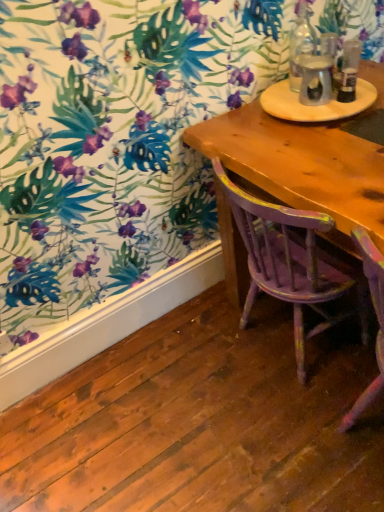
The image size is (384, 512). What are the coordinates of `free space above wooden round table at upper right (from a real-world perspective)` in the screenshot? It's located at (316, 90).